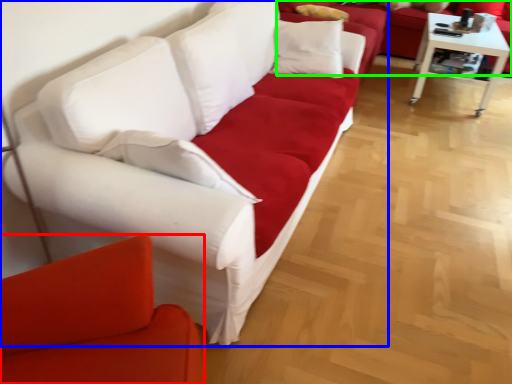
Question: Which is farther away from studio couch (highlighted by a red box)? studio couch (highlighted by a blue box) or studio couch (highlighted by a green box)?

Choices:
 (A) studio couch
 (B) studio couch

Answer: (B)